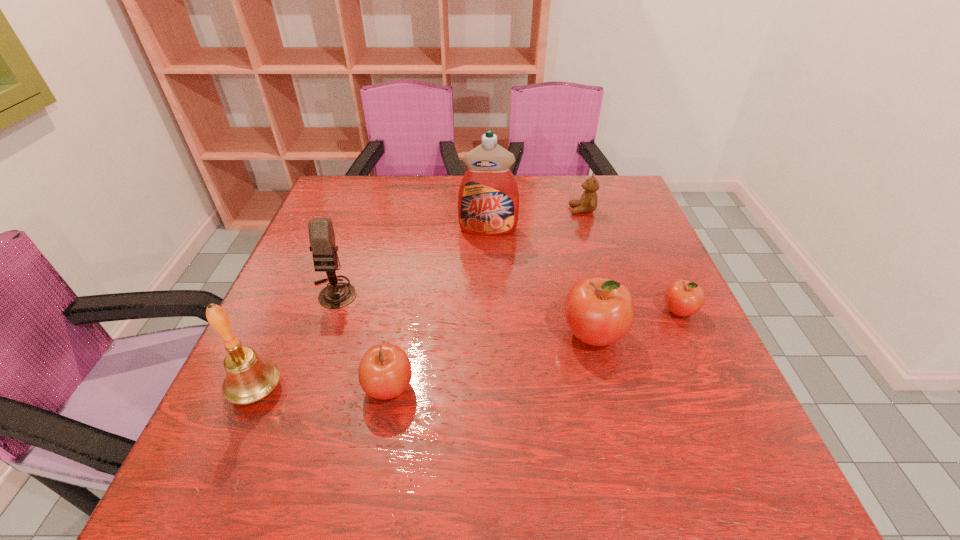
Where is `vacant space that is in between the fifth object from right to left and the detergent`? Image resolution: width=960 pixels, height=540 pixels. vacant space that is in between the fifth object from right to left and the detergent is located at coordinates (439, 309).

Locate an element on the screen. The width and height of the screenshot is (960, 540). blank region between the leftmost apple and the tallest apple is located at coordinates (491, 361).

At what (x,y) coordinates should I click in order to perform the action: click on vacant region between the microphone and the bell. Please return your answer as a coordinate pair (x, y). This screenshot has width=960, height=540. Looking at the image, I should click on (296, 340).

Identify which object is located as the second nearest to the teddy bear. Please provide its 2D coordinates. Your answer should be formatted as a tuple, i.e. [(x, y)], where the tuple contains the x and y coordinates of a point satisfying the conditions above.

[(683, 298)]

Image resolution: width=960 pixels, height=540 pixels. Find the location of `object that can be found as the third closest to the tallest object`. object that can be found as the third closest to the tallest object is located at coordinates coord(598,311).

Select which apple appears as the third closest to the bell. Please provide its 2D coordinates. Your answer should be formatted as a tuple, i.e. [(x, y)], where the tuple contains the x and y coordinates of a point satisfying the conditions above.

[(683, 298)]

Identify which apple is the second nearest to the tallest apple. Please provide its 2D coordinates. Your answer should be formatted as a tuple, i.e. [(x, y)], where the tuple contains the x and y coordinates of a point satisfying the conditions above.

[(385, 372)]

The height and width of the screenshot is (540, 960). I want to click on free space that satisfies the following two spatial constraints: 1. on the front-facing side of the teddy bear; 2. on the right side of the rightmost object, so click(613, 310).

The width and height of the screenshot is (960, 540). What are the coordinates of `free spot that satisfies the following two spatial constraints: 1. on the front-facing side of the teddy bear; 2. on the front surface of the fourth object from left to right` in the screenshot? It's located at click(588, 230).

This screenshot has height=540, width=960. I want to click on blank area in the image that satisfies the following two spatial constraints: 1. on the back side of the tallest apple; 2. on the left side of the rightmost object, so click(587, 310).